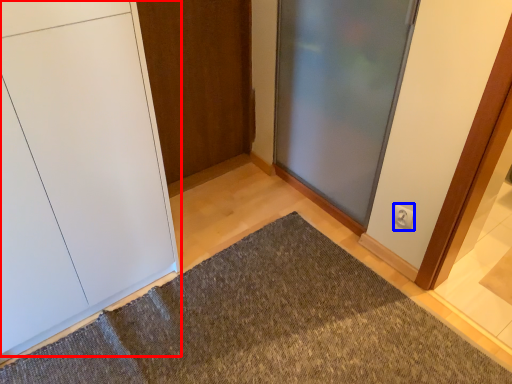
Question: Among these objects, which one is nearest to the camera, door (highlighted by a red box) or electric outlet (highlighted by a blue box)?

Choices:
 (A) door
 (B) electric outlet

Answer: (A)